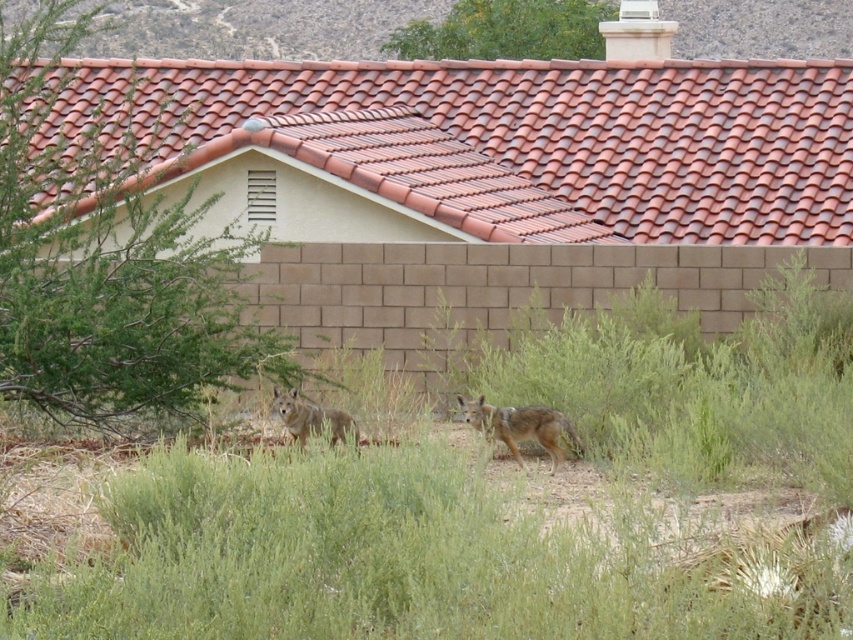
Does terracotta clay tiles at upper center have a greater width compared to brown fur coyote at center?

Yes, terracotta clay tiles at upper center is wider than brown fur coyote at center.

Is point (345, 97) farther from camera compared to point (556, 460)?

Yes, it is behind point (556, 460).

Does point (554, 177) come farther from viewer compared to point (526, 406)?

That is True.

At what (x,y) coordinates should I click in order to perform the action: click on terracotta clay tiles at upper center. Please return your answer as a coordinate pair (x, y). The width and height of the screenshot is (853, 640). Looking at the image, I should click on (524, 138).

Which is more to the left, green leafy bush at left or brown fur coyote at center?

Positioned to the left is green leafy bush at left.

This screenshot has width=853, height=640. What do you see at coordinates (108, 259) in the screenshot?
I see `green leafy bush at left` at bounding box center [108, 259].

At what (x,y) coordinates should I click in order to perform the action: click on green leafy bush at left. Please return your answer as a coordinate pair (x, y). Image resolution: width=853 pixels, height=640 pixels. Looking at the image, I should click on (108, 259).

Find the location of a particular element. green leafy bush at left is located at coordinates (108, 259).

Is green leafy bush at left below green leafy bush at upper center?

Yes, green leafy bush at left is below green leafy bush at upper center.

Between point (96, 118) and point (547, 13), which one is positioned behind?

The point (547, 13) is behind.

Where is `green leafy bush at left`? The image size is (853, 640). green leafy bush at left is located at coordinates (108, 259).